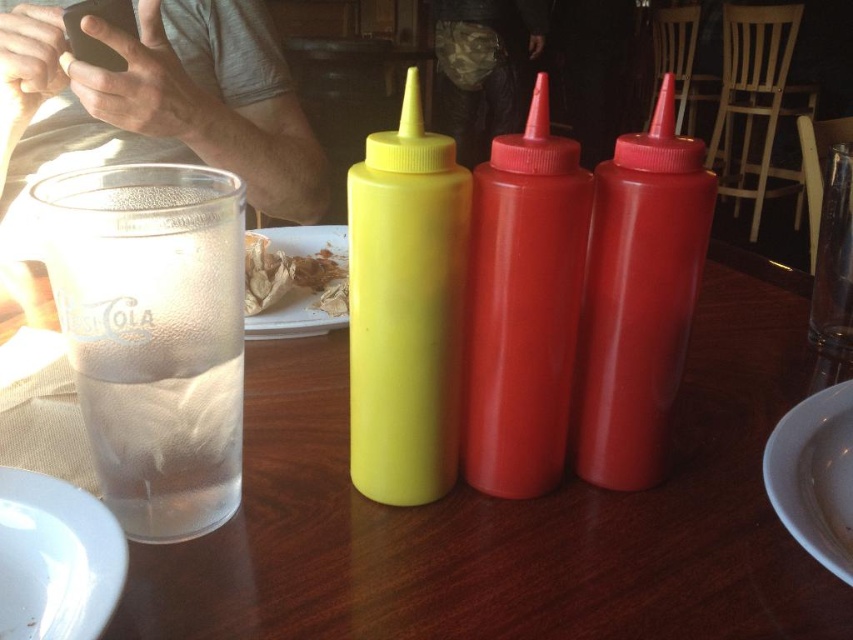
Is matte plastic condiment bottles at center thinner than white ceramic plate at lower right?

Incorrect, matte plastic condiment bottles at center's width is not less than white ceramic plate at lower right's.

Does matte plastic condiment bottles at center have a greater height compared to white ceramic plate at lower right?

Indeed, matte plastic condiment bottles at center has a greater height compared to white ceramic plate at lower right.

The height and width of the screenshot is (640, 853). Find the location of `matte plastic condiment bottles at center`. matte plastic condiment bottles at center is located at coordinates (515, 515).

Who is positioned more to the left, yellow matte plastic mustard at center or white glossy plate at lower left?

From the viewer's perspective, white glossy plate at lower left appears more on the left side.

Is yellow matte plastic mustard at center bigger than white glossy plate at lower left?

Yes.

Is point (428, 164) positioned behind point (54, 528)?

Yes.

The image size is (853, 640). Find the location of `yellow matte plastic mustard at center`. yellow matte plastic mustard at center is located at coordinates (405, 308).

Is white ceramic plate at lower right bigger than brown crumpled paper at center?

No.

Who is positioned more to the left, white ceramic plate at lower right or brown crumpled paper at center?

brown crumpled paper at center

Measure the distance between white ceramic plate at lower right and camera.

They are 9.23 inches apart.

Image resolution: width=853 pixels, height=640 pixels. I want to click on white ceramic plate at lower right, so [815, 476].